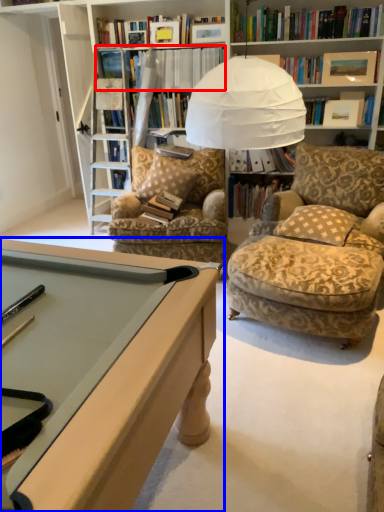
Question: Which object is closer to the camera taking this photo, book (highlighted by a red box) or desk (highlighted by a blue box)?

Choices:
 (A) book
 (B) desk

Answer: (B)